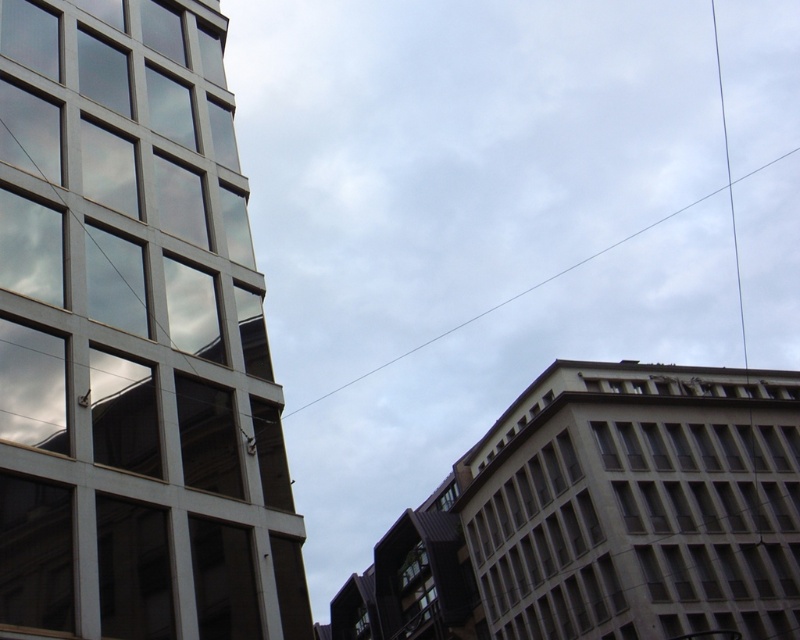
Question: Which object is closer to the camera taking this photo?

Choices:
 (A) beige concrete building at right
 (B) transparent glass window at upper left
 (C) clear glass window at lower center
 (D) white wire at upper center

Answer: (B)

Question: Considering the relative positions of transparent glass window at upper left and clear glass window at lower center in the image provided, where is transparent glass window at upper left located with respect to clear glass window at lower center?

Choices:
 (A) left
 (B) right

Answer: (A)

Question: Is transparent glass window at upper left positioned behind clear glass window at lower center?

Choices:
 (A) yes
 (B) no

Answer: (B)

Question: Which of these objects is positioned farthest from the beige concrete building at right?

Choices:
 (A) white wire at upper center
 (B) matte glass building at left

Answer: (A)

Question: Can you confirm if white wire at upper center is positioned below transparent glass window at upper left?

Choices:
 (A) no
 (B) yes

Answer: (B)

Question: Which point appears farthest from the camera in this image?

Choices:
 (A) (64, 605)
 (B) (408, 552)

Answer: (B)